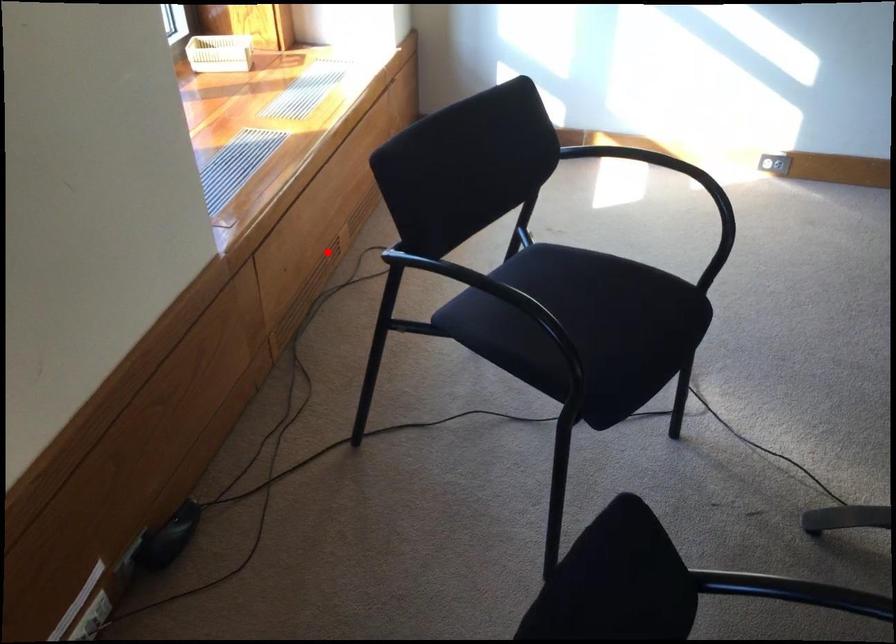
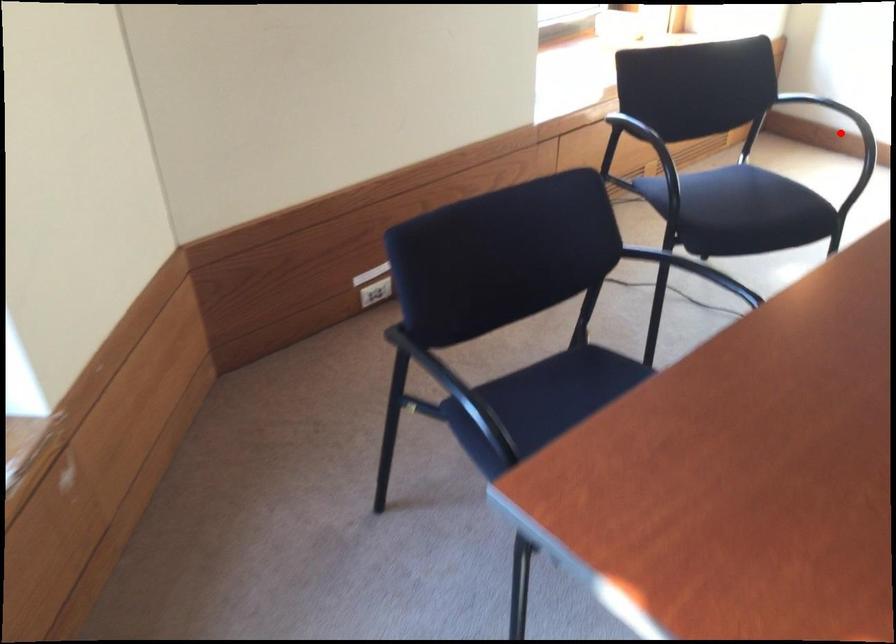
I am providing you with two images of the same scene from different viewpoints. A red point is marked on the first image and another point is marked on the second image. Is the marked point in image1 the same physical position as the marked point in image2?

No